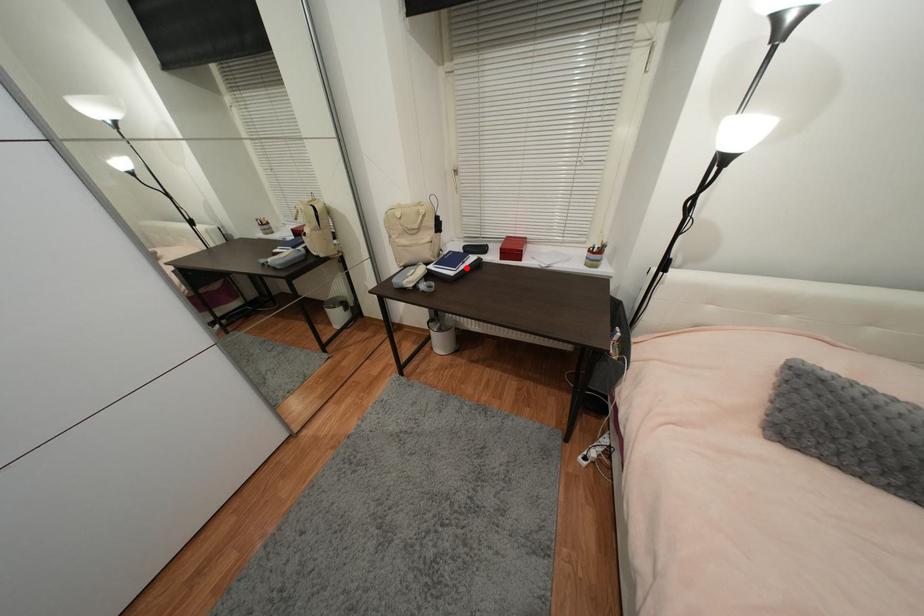
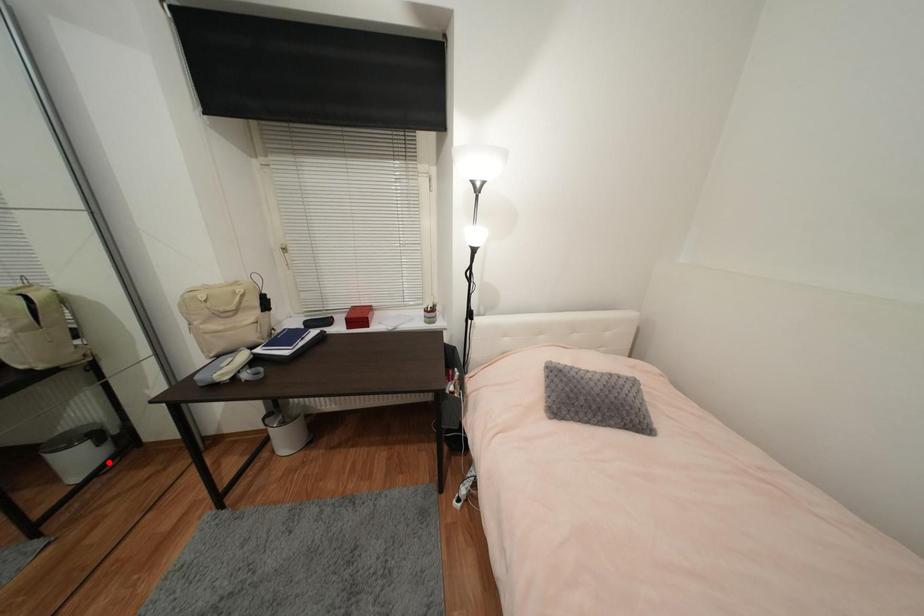
I am providing you with two images of the same scene from different viewpoints. A red point is marked on the first image and another point is marked on the second image. Does the point marked in image1 correspond to the same location as the one in image2?

No